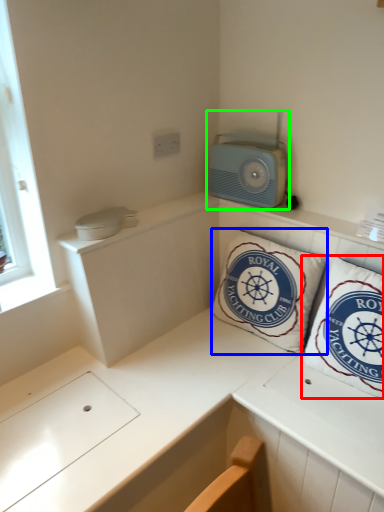
Question: Which object is positioned farthest from pillow (highlighted by a red box)? Select from pillow (highlighted by a blue box) and appliance (highlighted by a green box).

Choices:
 (A) pillow
 (B) appliance

Answer: (B)